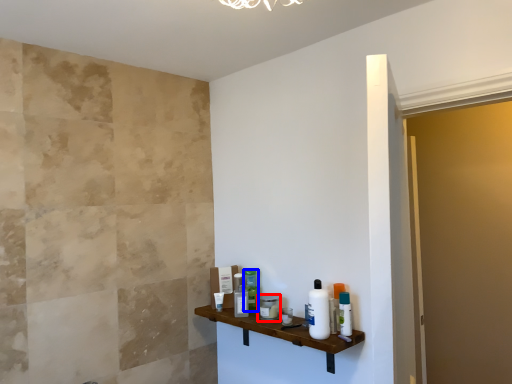
Question: Among these objects, which one is farthest to the camera, toiletry (highlighted by a red box) or toiletry (highlighted by a blue box)?

Choices:
 (A) toiletry
 (B) toiletry

Answer: (B)